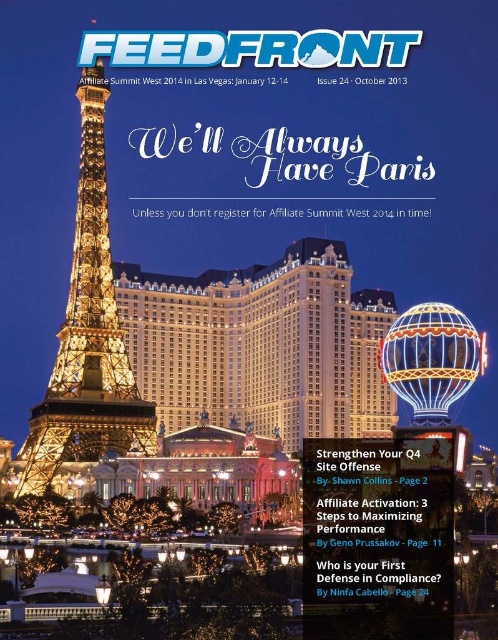
Is illuminated glass hotel at center thinner than illuminated steel eiffel tower at left?

No, illuminated glass hotel at center is not thinner than illuminated steel eiffel tower at left.

Between illuminated glass hotel at center and illuminated steel eiffel tower at left, which one is positioned lower?

illuminated glass hotel at center is lower down.

Is point (307, 260) farther from viewer compared to point (31, 467)?

Yes, it is.

Where is `illuminated glass hotel at center`? illuminated glass hotel at center is located at coordinates 261,346.